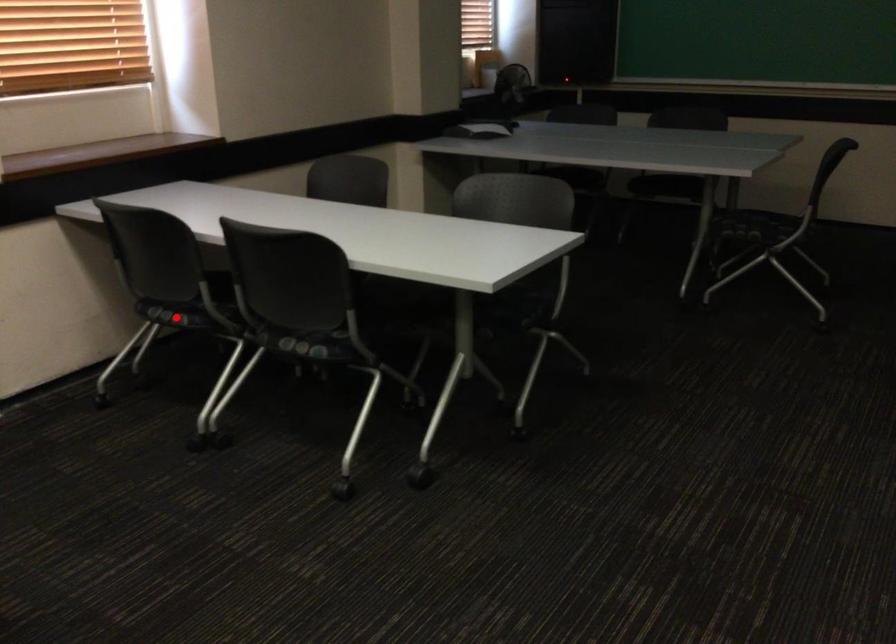
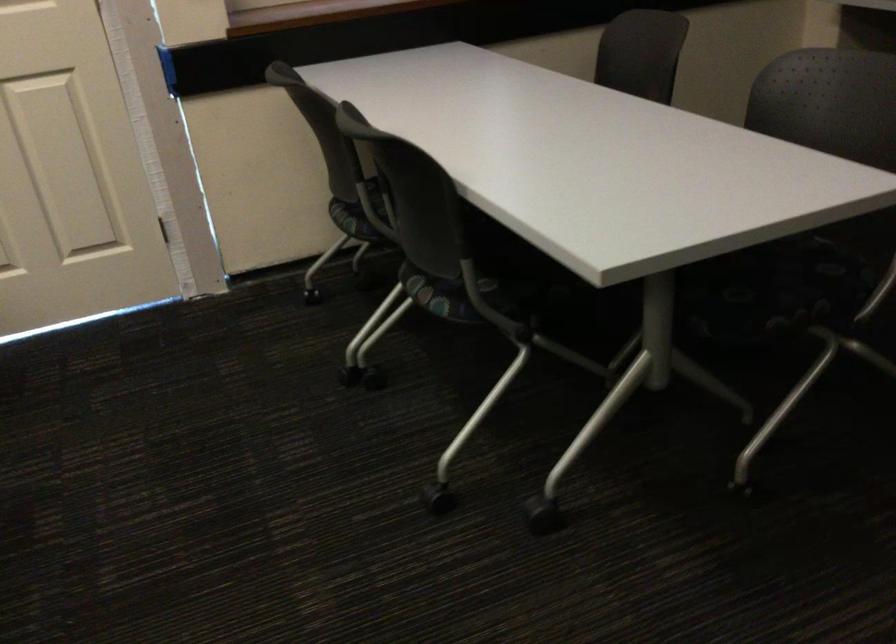
Question: I am providing you with two images of the same scene from different viewpoints. Given a red point in image1, look at the same physical point in image2. Is it:

Choices:
 (A) Closer to the viewpoint
 (B) Farther from the viewpoint

Answer: (A)